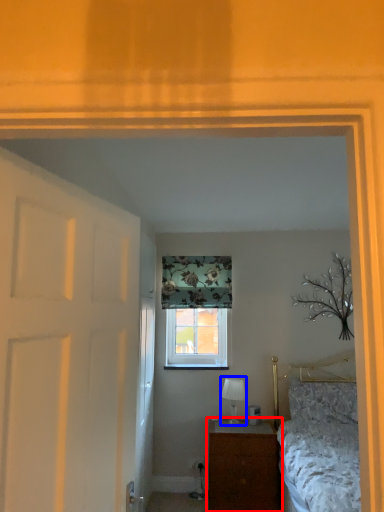
Question: Among these objects, which one is nearest to the camera, nightstand (highlighted by a red box) or table lamp (highlighted by a blue box)?

Choices:
 (A) nightstand
 (B) table lamp

Answer: (A)